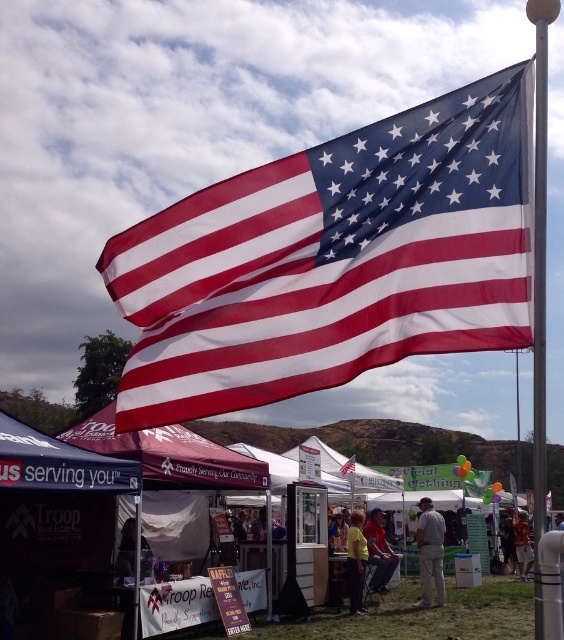
Measure the distance from gray fabric at center to red shirt at center.

gray fabric at center and red shirt at center are 3.78 feet apart.

Is gray fabric at center positioned in front of red shirt at center?

Yes, it is.

This screenshot has height=640, width=564. What do you see at coordinates (429, 552) in the screenshot? I see `gray fabric at center` at bounding box center [429, 552].

This screenshot has height=640, width=564. Find the location of `gray fabric at center`. gray fabric at center is located at coordinates (429, 552).

Does yellow fabric shirt at center have a larger size compared to red-white-blue fabric flag at upper center?

Actually, yellow fabric shirt at center might be smaller than red-white-blue fabric flag at upper center.

Identify the location of yellow fabric shirt at center. (355, 561).

Between gray fabric at center and yellow fabric shirt at center, which one has less height?

yellow fabric shirt at center is shorter.

Is gray fabric at center above yellow fabric shirt at center?

Indeed, gray fabric at center is positioned over yellow fabric shirt at center.

Is point (434, 577) farther from viewer compared to point (360, 588)?

Yes, it is.

Locate an element on the screen. This screenshot has height=640, width=564. gray fabric at center is located at coordinates (429, 552).